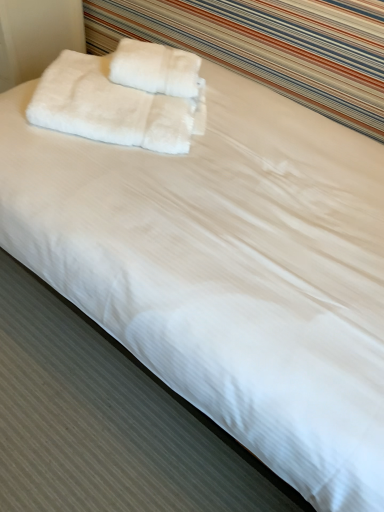
Where is `white fluffy towel at upper center, the 2th towel viewed from the left`? The image size is (384, 512). white fluffy towel at upper center, the 2th towel viewed from the left is located at coordinates (155, 68).

The image size is (384, 512). What do you see at coordinates (155, 68) in the screenshot?
I see `white fluffy towel at upper center, the 2th towel viewed from the left` at bounding box center [155, 68].

Describe the element at coordinates (115, 106) in the screenshot. Image resolution: width=384 pixels, height=512 pixels. I see `white fluffy towels at upper left, the second towel viewed from the right` at that location.

Identify the location of white fluffy towels at upper left, which is the 1th towel from left to right. (115, 106).

Where is `white fluffy towel at upper center, the 1th towel positioned from the right`? This screenshot has height=512, width=384. white fluffy towel at upper center, the 1th towel positioned from the right is located at coordinates (155, 68).

Is white fluffy towels at upper left, which is the 1th towel from left to right, at the left side of white fluffy towel at upper center, the 1th towel positioned from the right?

Yes, white fluffy towels at upper left, which is the 1th towel from left to right, is to the left of white fluffy towel at upper center, the 1th towel positioned from the right.

Which object is closer to the camera taking this photo, white fluffy towels at upper left, the second towel viewed from the right, or white fluffy towel at upper center, the 2th towel viewed from the left?

white fluffy towels at upper left, the second towel viewed from the right, is closer to the camera.

Does point (105, 106) come closer to viewer compared to point (152, 80)?

Yes, it is.

Consider the image. From the image's perspective, does white fluffy towels at upper left, the second towel viewed from the right, appear higher than white fluffy towel at upper center, the 2th towel viewed from the left?

Actually, white fluffy towels at upper left, the second towel viewed from the right, appears below white fluffy towel at upper center, the 2th towel viewed from the left, in the image.

From a real-world perspective, between white fluffy towels at upper left, the second towel viewed from the right, and white fluffy towel at upper center, the 2th towel viewed from the left, who is vertically higher?

white fluffy towel at upper center, the 2th towel viewed from the left, is physically above.

Which of these two, white fluffy towels at upper left, the second towel viewed from the right, or white fluffy towel at upper center, the 2th towel viewed from the left, is wider?

With larger width is white fluffy towels at upper left, the second towel viewed from the right.

Can you confirm if white fluffy towels at upper left, which is the 1th towel from left to right, is taller than white fluffy towel at upper center, the 1th towel positioned from the right?

Correct, white fluffy towels at upper left, which is the 1th towel from left to right, is much taller as white fluffy towel at upper center, the 1th towel positioned from the right.

Considering the relative sizes of white fluffy towels at upper left, the second towel viewed from the right, and white fluffy towel at upper center, the 2th towel viewed from the left, in the image provided, is white fluffy towels at upper left, the second towel viewed from the right, bigger than white fluffy towel at upper center, the 2th towel viewed from the left,?

Indeed, white fluffy towels at upper left, the second towel viewed from the right, has a larger size compared to white fluffy towel at upper center, the 2th towel viewed from the left.

Is white fluffy towel at upper center, the 1th towel positioned from the right, inside white fluffy towels at upper left, the second towel viewed from the right?

Yes, white fluffy towel at upper center, the 1th towel positioned from the right, is inside white fluffy towels at upper left, the second towel viewed from the right.

Is white fluffy towels at upper left, which is the 1th towel from left to right, not near white fluffy towel at upper center, the 2th towel viewed from the left?

They are positioned close to each other.

Is white fluffy towels at upper left, which is the 1th towel from left to right, looking in the opposite direction of white fluffy towel at upper center, the 2th towel viewed from the left?

white fluffy towels at upper left, which is the 1th towel from left to right, does not have its back to white fluffy towel at upper center, the 2th towel viewed from the left.

How many degrees apart are the facing directions of white fluffy towels at upper left, which is the 1th towel from left to right, and white fluffy towel at upper center, the 2th towel viewed from the left?

The angular difference between white fluffy towels at upper left, which is the 1th towel from left to right, and white fluffy towel at upper center, the 2th towel viewed from the left, is 1.05 degrees.

How far apart are white fluffy towels at upper left, which is the 1th towel from left to right, and white fluffy towel at upper center, the 1th towel positioned from the right?

white fluffy towels at upper left, which is the 1th towel from left to right, is 8.21 centimeters away from white fluffy towel at upper center, the 1th towel positioned from the right.

You are a GUI agent. You are given a task and a screenshot of the screen. Output one action in this format:
    pyautogui.click(x=<x>, y=<y>)
    Task: Click on the towel lying above the white fluffy towels at upper left, the second towel viewed from the right (from the image's perspective)
    The image size is (384, 512).
    Given the screenshot: What is the action you would take?
    pyautogui.click(x=155, y=68)

Considering the relative positions of white fluffy towel at upper center, the 1th towel positioned from the right, and white fluffy towels at upper left, the second towel viewed from the right, in the image provided, is white fluffy towel at upper center, the 1th towel positioned from the right, to the right of white fluffy towels at upper left, the second towel viewed from the right, from the viewer's perspective?

Indeed, white fluffy towel at upper center, the 1th towel positioned from the right, is positioned on the right side of white fluffy towels at upper left, the second towel viewed from the right.

Which is behind, white fluffy towel at upper center, the 1th towel positioned from the right, or white fluffy towels at upper left, which is the 1th towel from left to right?

white fluffy towel at upper center, the 1th towel positioned from the right.

Is point (186, 85) positioned behind point (41, 86)?

That is True.

From the image's perspective, who appears lower, white fluffy towel at upper center, the 1th towel positioned from the right, or white fluffy towels at upper left, the second towel viewed from the right?

white fluffy towels at upper left, the second towel viewed from the right.

From a real-world perspective, is white fluffy towel at upper center, the 2th towel viewed from the left, on top of white fluffy towels at upper left, the second towel viewed from the right?

Indeed, from a real-world perspective, white fluffy towel at upper center, the 2th towel viewed from the left, stands above white fluffy towels at upper left, the second towel viewed from the right.

Considering the sizes of white fluffy towel at upper center, the 2th towel viewed from the left, and white fluffy towels at upper left, the second towel viewed from the right, in the image, is white fluffy towel at upper center, the 2th towel viewed from the left, wider or thinner than white fluffy towels at upper left, the second towel viewed from the right,?

white fluffy towel at upper center, the 2th towel viewed from the left, is thinner than white fluffy towels at upper left, the second towel viewed from the right.

In terms of height, does white fluffy towel at upper center, the 2th towel viewed from the left, look taller or shorter compared to white fluffy towels at upper left, which is the 1th towel from left to right?

white fluffy towel at upper center, the 2th towel viewed from the left, is shorter than white fluffy towels at upper left, which is the 1th towel from left to right.

Who is bigger, white fluffy towel at upper center, the 2th towel viewed from the left, or white fluffy towels at upper left, which is the 1th towel from left to right?

With larger size is white fluffy towels at upper left, which is the 1th towel from left to right.

Would you say white fluffy towels at upper left, the second towel viewed from the right, is part of white fluffy towel at upper center, the 2th towel viewed from the left,'s contents?

No, white fluffy towels at upper left, the second towel viewed from the right, is not inside white fluffy towel at upper center, the 2th towel viewed from the left.

In the scene shown: Is white fluffy towel at upper center, the 2th towel viewed from the left, far away from white fluffy towels at upper left, the second towel viewed from the right?

That's not correct — white fluffy towel at upper center, the 2th towel viewed from the left, is a little close to white fluffy towels at upper left, the second towel viewed from the right.

Could you tell me if white fluffy towel at upper center, the 1th towel positioned from the right, is facing white fluffy towels at upper left, which is the 1th towel from left to right?

No, white fluffy towel at upper center, the 1th towel positioned from the right, is not aimed at white fluffy towels at upper left, which is the 1th towel from left to right.

How different are the orientations of white fluffy towel at upper center, the 1th towel positioned from the right, and white fluffy towels at upper left, which is the 1th towel from left to right, in degrees?

1.05 degrees separate the facing orientations of white fluffy towel at upper center, the 1th towel positioned from the right, and white fluffy towels at upper left, which is the 1th towel from left to right.

How far apart are white fluffy towel at upper center, the 1th towel positioned from the right, and white fluffy towels at upper left, the second towel viewed from the right?

They are 3.23 inches apart.

The image size is (384, 512). I want to click on towel to the left of white fluffy towel at upper center, the 1th towel positioned from the right, so [x=115, y=106].

The height and width of the screenshot is (512, 384). In order to click on towel in front of the white fluffy towel at upper center, the 2th towel viewed from the left in this screenshot , I will do `click(115, 106)`.

Where is `towel below the white fluffy towel at upper center, the 2th towel viewed from the left (from the image's perspective)`? This screenshot has height=512, width=384. towel below the white fluffy towel at upper center, the 2th towel viewed from the left (from the image's perspective) is located at coordinates (115, 106).